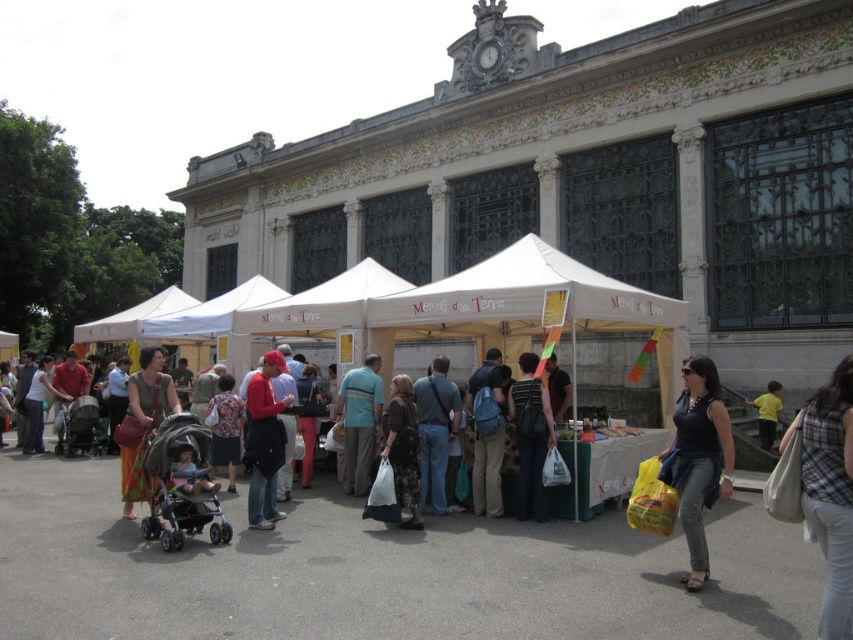
Question: Is matte red cap at center smaller than floral dress at center?

Choices:
 (A) yes
 (B) no

Answer: (B)

Question: Is denim jeans at center to the left of yellow fabric at lower right from the viewer's perspective?

Choices:
 (A) yes
 (B) no

Answer: (A)

Question: Which object appears closest to the camera in this image?

Choices:
 (A) matte black stroller at center
 (B) matte black bag at center

Answer: (A)

Question: Is matte black tank top at center positioned in front of yellow fabric at lower right?

Choices:
 (A) yes
 (B) no

Answer: (A)

Question: Which object is farther from the camera taking this photo?

Choices:
 (A) matte black bag at center
 (B) floral dress at center
 (C) blue backpack at center
 (D) matte red cap at center

Answer: (B)

Question: Considering the real-world distances, which object is closest to the yellow fabric at lower right?

Choices:
 (A) matte black bag at center
 (B) matte red cap at center
 (C) denim jeans at center

Answer: (C)